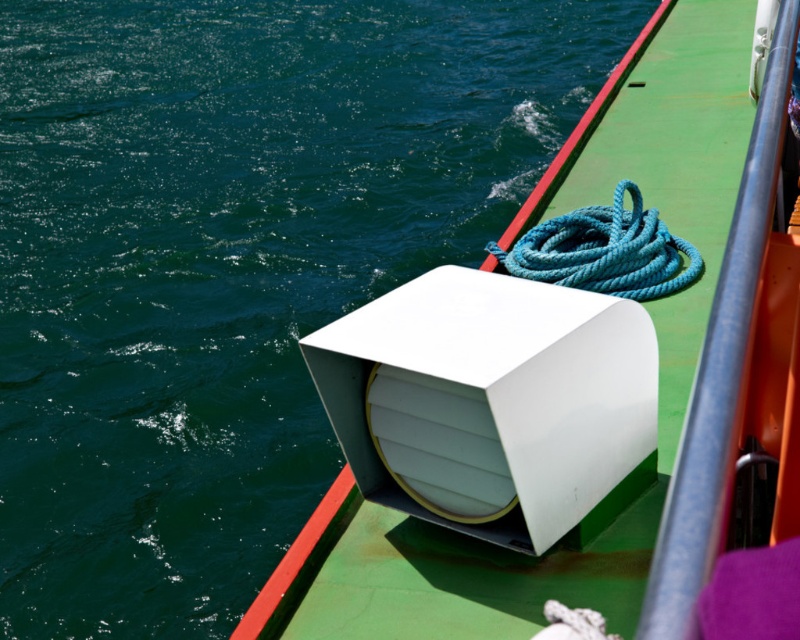
You are standing on the boat deck and see the point marked at coordinates (574, 380). What object is located at that point?

The point at (574, 380) is on the white matte speaker at center.

In the scene shown: You are on a boat deck and need to locate the white matte speaker at center and the teal rope at upper right. According to the scene, which object is positioned to the right of the other?

The white matte speaker at center is to the right of teal rope at upper right.